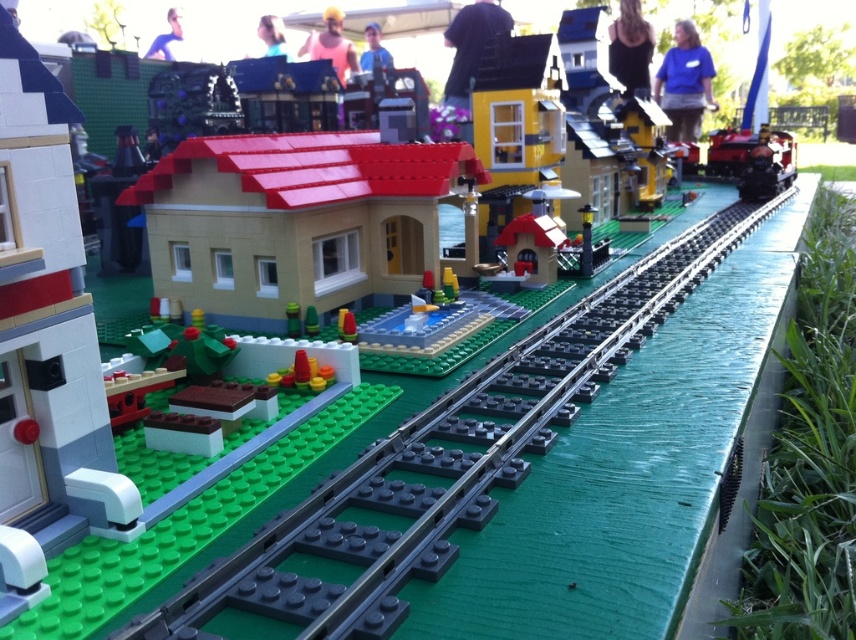
Who is positioned more to the left, matte black hat at upper center or blonde hair at upper center?

blonde hair at upper center

Between point (462, 29) and point (283, 54), which one is positioned behind?

Point (283, 54)

Does point (465, 74) come in front of point (282, 36)?

Yes, it is in front of point (282, 36).

In order to click on matte black hat at upper center in this screenshot , I will do `click(470, 44)`.

In the scene shown: Which is more to the right, shiny red train at right or blonde hair at upper center?

shiny red train at right is more to the right.

Is shiny red train at right further to camera compared to blonde hair at upper center?

No, it is not.

At what (x,y) coordinates should I click in order to perform the action: click on shiny red train at right. Please return your answer as a coordinate pair (x, y). Looking at the image, I should click on (753, 160).

Does pink fabric shirt at upper center have a smaller size compared to blue shirt at upper center?

No, pink fabric shirt at upper center is not smaller than blue shirt at upper center.

The height and width of the screenshot is (640, 856). I want to click on pink fabric shirt at upper center, so click(331, 44).

At what (x,y) coordinates should I click in order to perform the action: click on pink fabric shirt at upper center. Please return your answer as a coordinate pair (x, y). The width and height of the screenshot is (856, 640). Looking at the image, I should click on (331, 44).